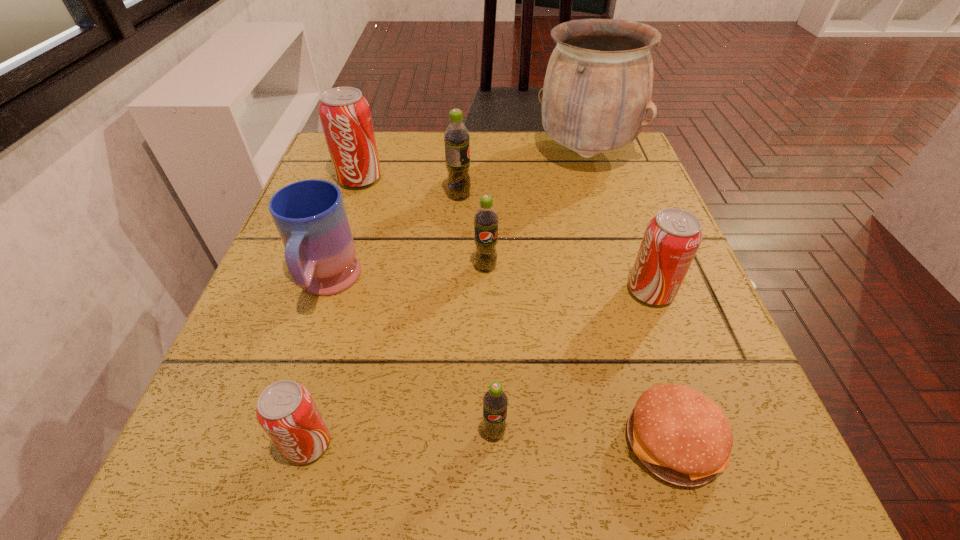
This screenshot has width=960, height=540. I want to click on hamburger, so click(682, 436).

You are a GUI agent. You are given a task and a screenshot of the screen. Output one action in this format:
    pyautogui.click(x=<x>, y=<y>)
    Task: Click on the blank space located on the front of the urn
    The height and width of the screenshot is (540, 960).
    Given the screenshot: What is the action you would take?
    pyautogui.click(x=615, y=247)

This screenshot has width=960, height=540. In order to click on vacant region located 0.120m on the logo side of the farthest red soda can in this screenshot , I will do `click(344, 226)`.

You are a GUI agent. You are given a task and a screenshot of the screen. Output one action in this format:
    pyautogui.click(x=<x>, y=<y>)
    Task: Click on the vacant region located on the front label of the leftmost green soda
    This screenshot has height=540, width=960.
    Given the screenshot: What is the action you would take?
    pyautogui.click(x=646, y=196)

Image resolution: width=960 pixels, height=540 pixels. I want to click on free space located on the side of the mug with the handle, so click(306, 347).

Where is `vacant area situated 0.380m on the logo side of the second farthest red soda can`? This screenshot has height=540, width=960. vacant area situated 0.380m on the logo side of the second farthest red soda can is located at coordinates (409, 291).

Identify the location of free space located on the logo side of the second farthest red soda can. (420, 291).

At what (x,y) coordinates should I click in order to perform the action: click on free space located on the logo side of the second farthest red soda can. Please return your answer as a coordinate pair (x, y). Looking at the image, I should click on (472, 291).

This screenshot has width=960, height=540. I want to click on free space located on the front label of the second nearest green soda, so click(488, 429).

The height and width of the screenshot is (540, 960). Find the location of `vacant space situated 0.050m on the front label of the smallest green soda`. vacant space situated 0.050m on the front label of the smallest green soda is located at coordinates (495, 483).